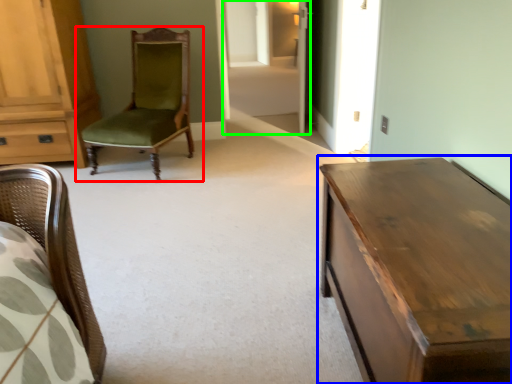
Question: Which is nearer to the chair (highlighted by a red box)? table (highlighted by a blue box) or glass door (highlighted by a green box).

Choices:
 (A) table
 (B) glass door

Answer: (B)